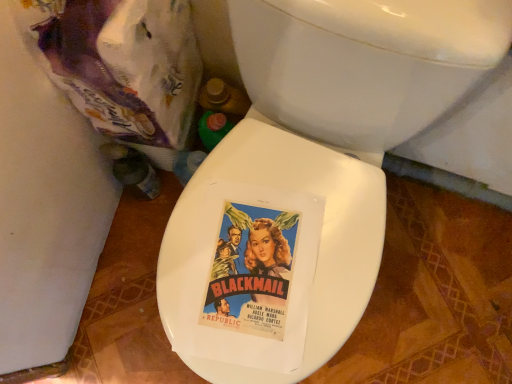
Question: Is point (240, 13) positioned closer to the camera than point (48, 34)?

Choices:
 (A) closer
 (B) farther

Answer: (A)

Question: From the image's perspective, is white glossy toilet seat at center located above or below purple plastic bag at upper left?

Choices:
 (A) above
 (B) below

Answer: (B)

Question: Choose the correct answer: Is white glossy toilet seat at center inside purple plastic bag at upper left or outside it?

Choices:
 (A) outside
 (B) inside

Answer: (A)

Question: From a real-world perspective, is purple plastic bag at upper left positioned above or below white glossy toilet seat at center?

Choices:
 (A) above
 (B) below

Answer: (A)

Question: From the image's perspective, is purple plastic bag at upper left above or below white glossy toilet seat at center?

Choices:
 (A) below
 (B) above

Answer: (B)

Question: Is purple plastic bag at upper left inside the boundaries of white glossy toilet seat at center, or outside?

Choices:
 (A) outside
 (B) inside

Answer: (A)

Question: Does point (103, 127) appear closer or farther from the camera than point (340, 89)?

Choices:
 (A) closer
 (B) farther

Answer: (B)